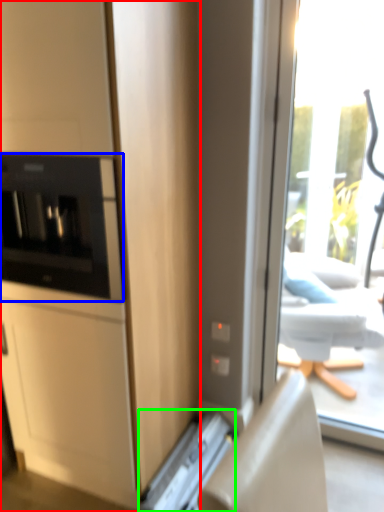
Question: Estimate the real-world distances between objects in this image. Which object is closer to cabinetry (highlighted by a red box), home appliance (highlighted by a blue box) or appliance (highlighted by a green box)?

Choices:
 (A) home appliance
 (B) appliance

Answer: (A)